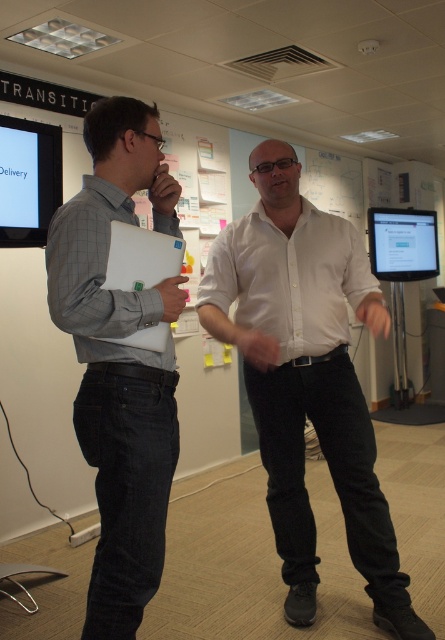
You are a delivery person who needs to place a 5 inch long package between the gray matte shirt at left and the white matte laptop at left. Can you fit it there?

The gray matte shirt at left is 5.19 inches away from the white matte laptop at left, so yes, the 5 inch long package can fit between them since the distance is slightly larger than the package.

Based on the photo, you are an office assistant who needs to deliver a document to the person wearing the white glossy shirt at center. The white matte laptop at left is blocking your path. Can you walk around the laptop to reach the shirt?

The white glossy shirt at center is positioned on the right side of the white matte laptop at left. Therefore, you can walk around the laptop to the right side to reach the person wearing the white glossy shirt at center.

You are an office assistant who needs to determine the seating arrangement for a meeting. The two participants are wearing the white glossy shirt at center and the gray matte shirt at left. According to the image, which participant should be seated closer to the whiteboard to ensure both can comfortably view it?

The white glossy shirt at center is taller than the gray matte shirt at left, so the white glossy shirt at center should be seated closer to the whiteboard to accommodate their height difference and ensure both can comfortably view it.